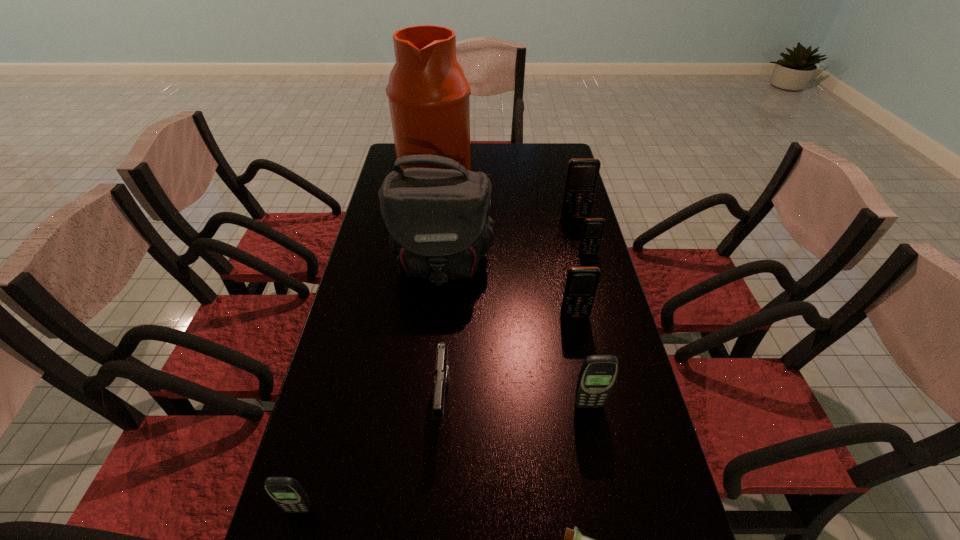
You are a GUI agent. You are given a task and a screenshot of the screen. Output one action in this format:
    pyautogui.click(x=<x>, y=<y>)
    Task: Click on the water jug
    
    Given the screenshot: What is the action you would take?
    pyautogui.click(x=428, y=93)

Find the location of a particular element. This screenshot has height=540, width=960. the farthest object is located at coordinates [428, 93].

Where is `gray shoulder bag`? This screenshot has width=960, height=540. gray shoulder bag is located at coordinates (437, 221).

Identify the location of shoulder bag. (437, 221).

Where is `the farthest orange cellular telephone`? The width and height of the screenshot is (960, 540). the farthest orange cellular telephone is located at coordinates (582, 174).

Image resolution: width=960 pixels, height=540 pixels. Find the location of `the tallest cellular telephone`. the tallest cellular telephone is located at coordinates (582, 174).

Where is `the right gray cellular telephone`? This screenshot has height=540, width=960. the right gray cellular telephone is located at coordinates (598, 373).

In order to click on the bigger gray cellular telephone in this screenshot , I will do `click(598, 373)`.

Identify the location of the third farthest cellular telephone. (581, 284).

Where is `the fifth farthest object`? the fifth farthest object is located at coordinates (581, 284).